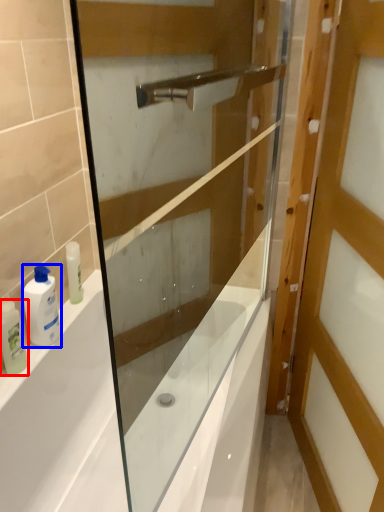
Question: Which point is closer to the camera, toiletry (highlighted by a red box) or toiletry (highlighted by a blue box)?

Choices:
 (A) toiletry
 (B) toiletry

Answer: (A)